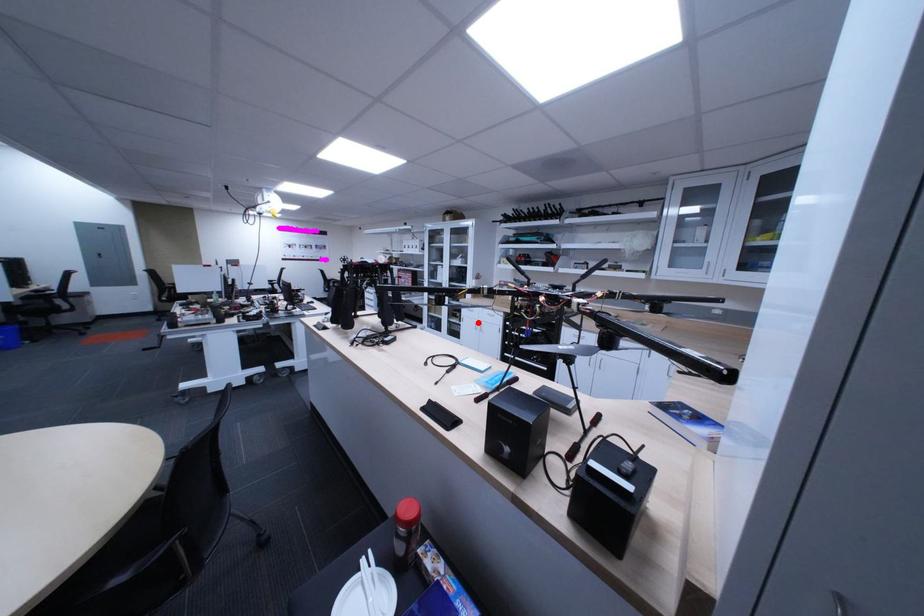
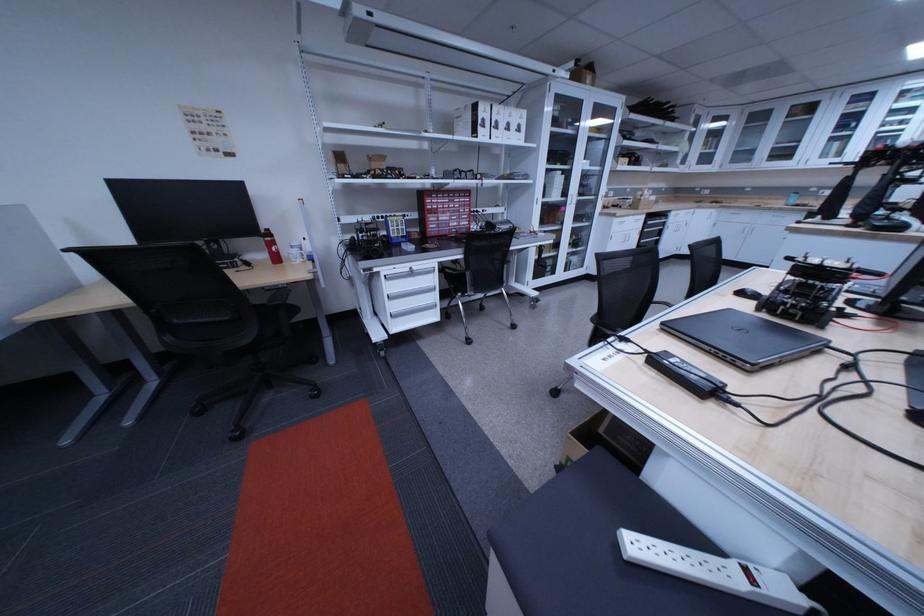
Locate, in the second image, the point that corresponds to the highlighted location in the first image.

(626, 241)